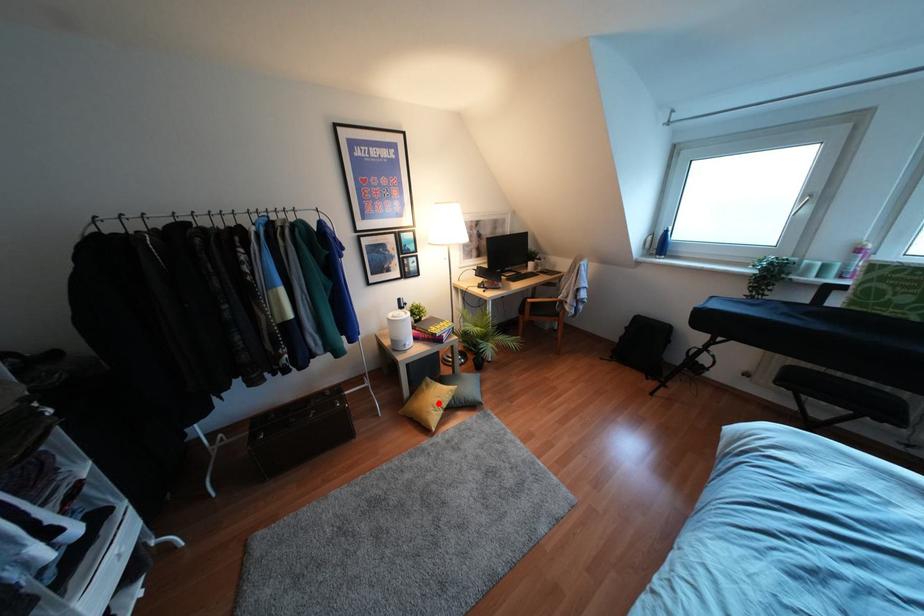
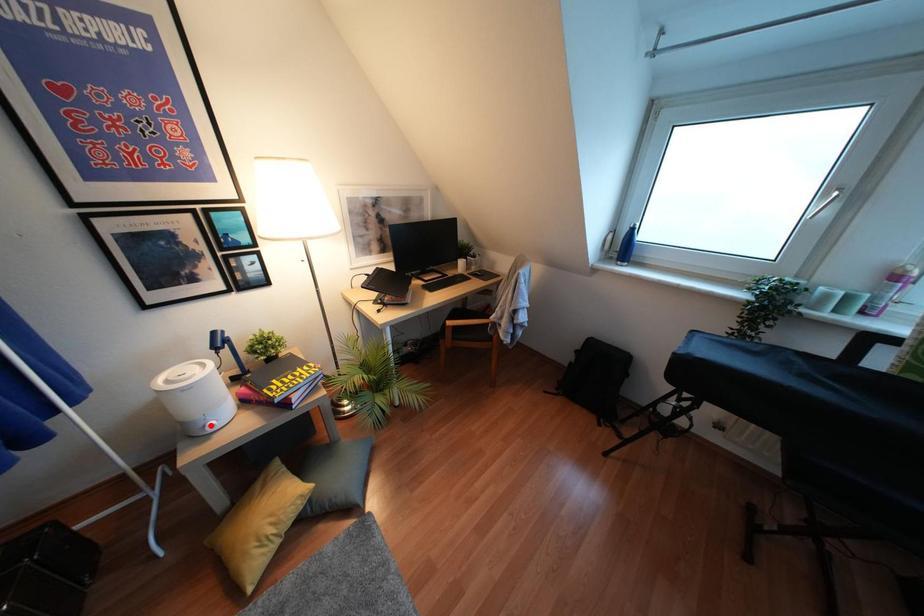
I am providing you with two images of the same scene from different viewpoints. A red point is marked on the first image and another point is marked on the second image. Is the red point in image1 aligned with the point shown in image2?

No